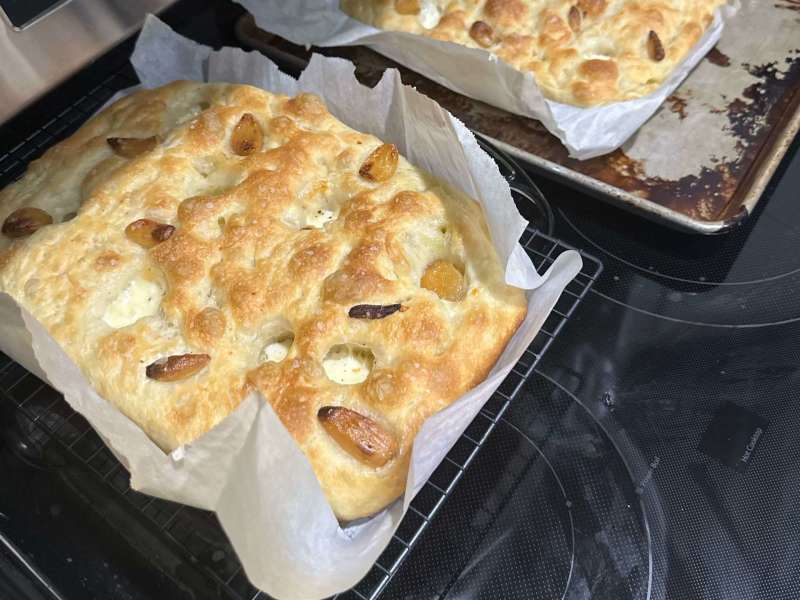
Locate an element on the screen. The image size is (800, 600). handle of an oven roasting tray is located at coordinates (516, 178).